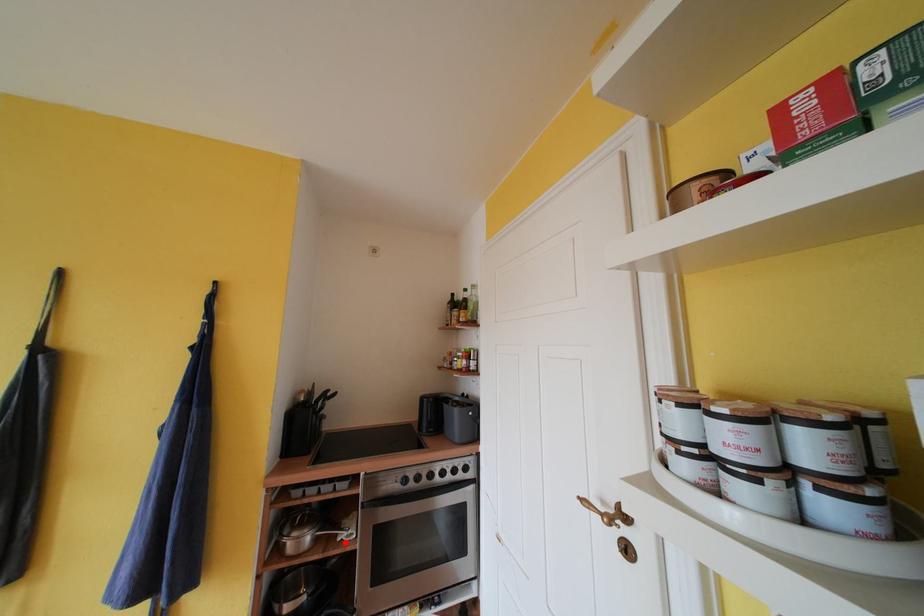
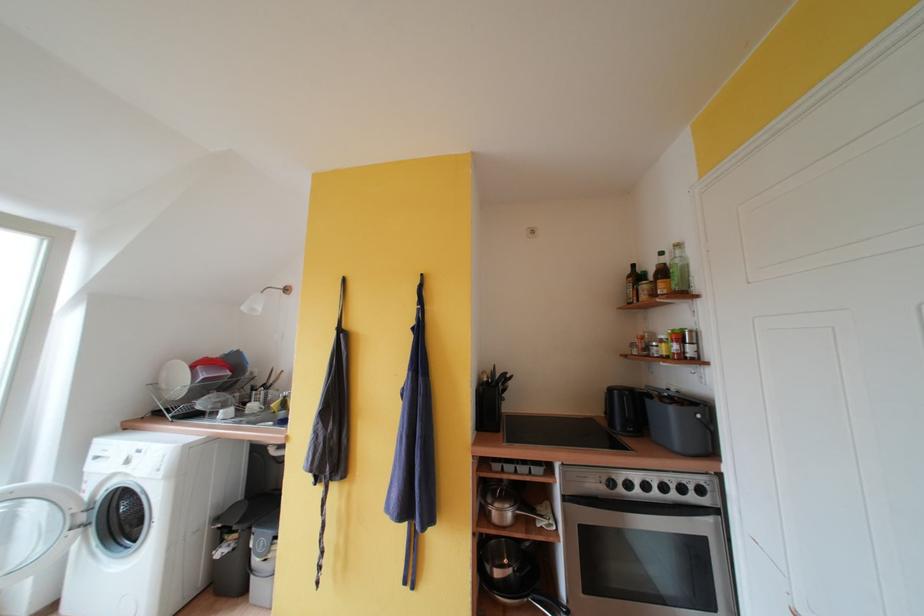
Question: I am providing you with two images of the same scene from different viewpoints. In image1, a red point is highlighted. Considering the same 3D point in image2, which of the following is correct?

Choices:
 (A) It is closer
 (B) It is farther

Answer: (B)